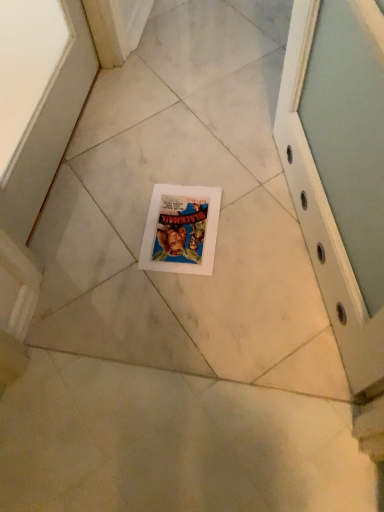
The height and width of the screenshot is (512, 384). What are the coordinates of `vacant region above white paper comic book at center (from a real-world perspective)` in the screenshot? It's located at (181, 223).